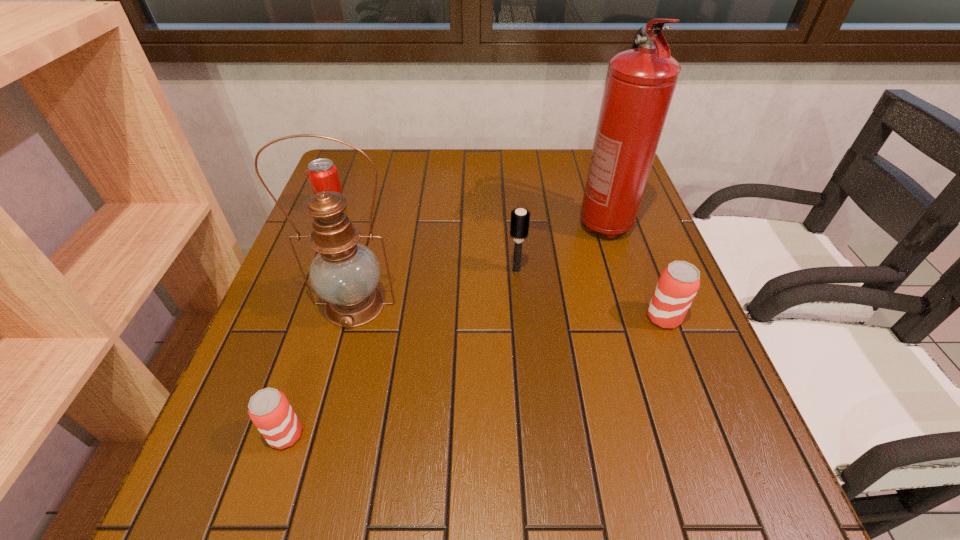
The width and height of the screenshot is (960, 540). I want to click on the nearest object, so click(269, 409).

I want to click on the shorter beer can, so click(x=269, y=409).

Identify the location of the farther beer can. The width and height of the screenshot is (960, 540). (678, 284).

Locate an element on the screen. The height and width of the screenshot is (540, 960). the right beer can is located at coordinates (678, 284).

Find the location of a particular element. The width and height of the screenshot is (960, 540). can is located at coordinates (319, 179).

Locate an element on the screen. The width and height of the screenshot is (960, 540). the third farthest object is located at coordinates (520, 218).

This screenshot has width=960, height=540. In order to click on hairbrush in this screenshot , I will do `click(520, 218)`.

Image resolution: width=960 pixels, height=540 pixels. Identify the location of fire extinguisher. coord(640,83).

Identify the location of oil lamp. (345, 273).

Find the location of a particular element. vacant space located on the back of the nearer beer can is located at coordinates (335, 284).